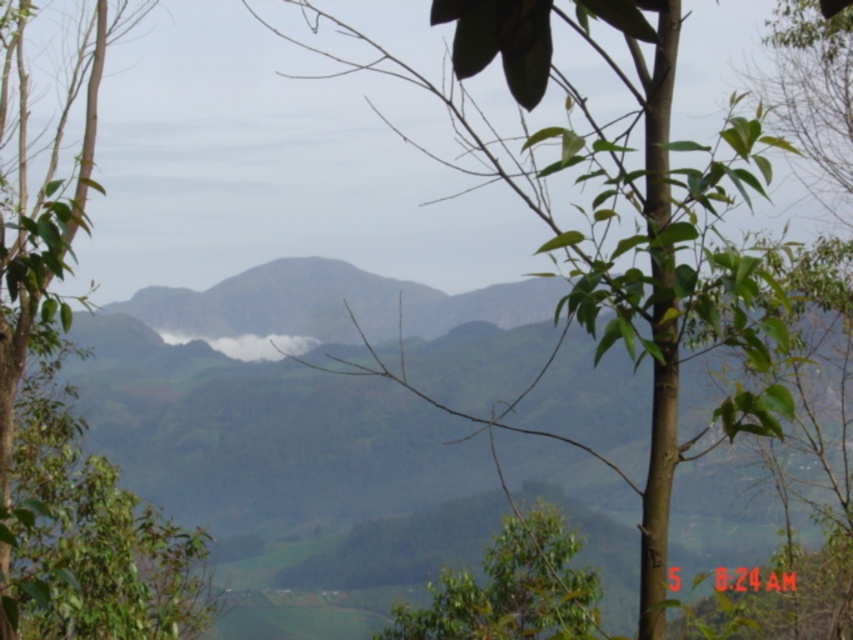
Looking at this image, you are an environmental scientist observing the landscape. You see the green leafy tree at center and the green leafy tree at left. Which tree would cast a longer shadow during midday when the sun is directly overhead?

The green leafy tree at center is taller than the green leafy tree at left. Since taller objects cast longer shadows, the green leafy tree at center would cast a longer shadow during midday when the sun is directly overhead.

You are an artist planning to paint this landscape. You want to ensure the green leafy tree at center and the white foggy cloud at center are proportionally accurate. Which object should you paint larger?

The green leafy tree at center should be painted larger than the white foggy cloud at center because the description states that the green leafy tree at center is bigger than the white foggy cloud at center.